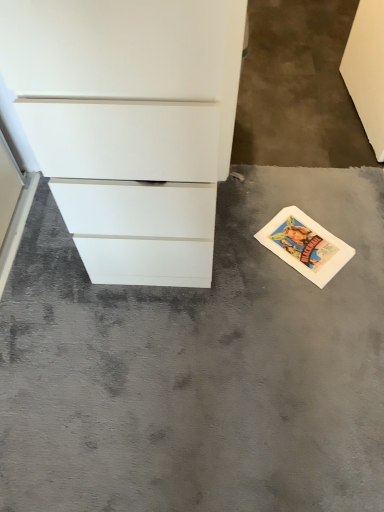
Question: Is gray concrete at lower right taller or shorter than white paper postcard at lower right?

Choices:
 (A) tall
 (B) short

Answer: (A)

Question: Is point (211, 494) positioned closer to the camera than point (284, 208)?

Choices:
 (A) farther
 (B) closer

Answer: (B)

Question: Which object is the farthest from the gray concrete at lower right?

Choices:
 (A) white paper postcard at lower right
 (B) white matte chest of drawers at left

Answer: (B)

Question: Estimate the real-world distances between objects in this image. Which object is closer to the white matte chest of drawers at left?

Choices:
 (A) gray concrete at lower right
 (B) white paper postcard at lower right

Answer: (A)